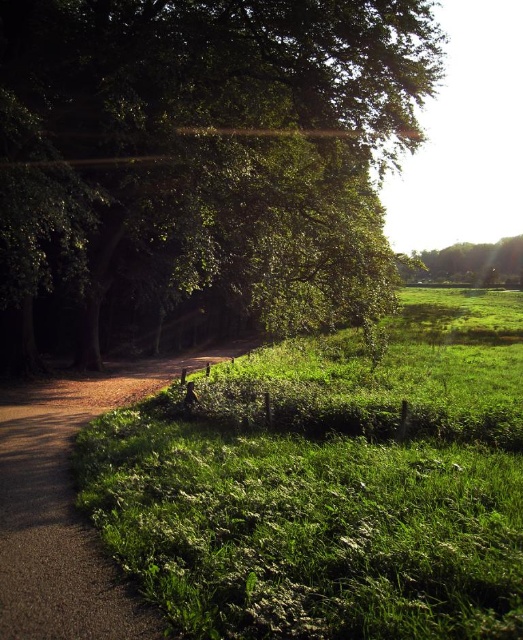
Question: Is green leafy tree at upper left to the right of green grassy at center from the viewer's perspective?

Choices:
 (A) yes
 (B) no

Answer: (B)

Question: Is dull brown dirt path at lower left to the left of green leafy tree at upper right from the viewer's perspective?

Choices:
 (A) no
 (B) yes

Answer: (B)

Question: Can you confirm if green leafy tree at upper left is bigger than dull brown dirt path at lower left?

Choices:
 (A) no
 (B) yes

Answer: (B)

Question: Among these points, which one is nearest to the camera?

Choices:
 (A) (459, 275)
 (B) (450, 424)
 (C) (115, 308)
 (D) (107, 580)

Answer: (D)

Question: Which object appears farthest from the camera in this image?

Choices:
 (A) dull brown dirt path at lower left
 (B) green grassy at center
 (C) green leafy tree at upper right

Answer: (C)

Question: Which of the following is the farthest from the observer?

Choices:
 (A) (260, 257)
 (B) (70, 566)

Answer: (A)